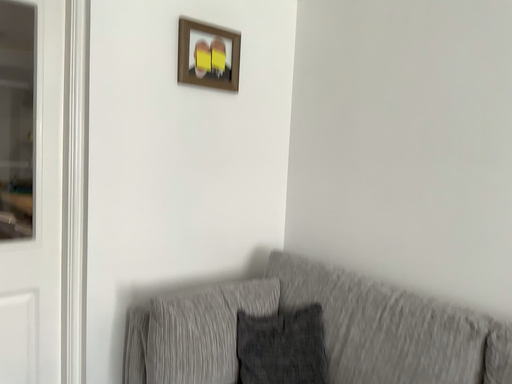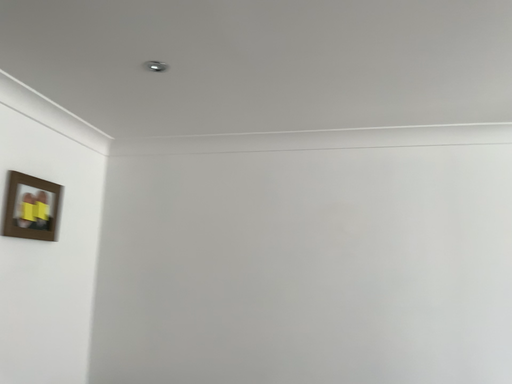
Question: Which way did the camera rotate in the video?

Choices:
 (A) rotated upward
 (B) rotated downward

Answer: (A)